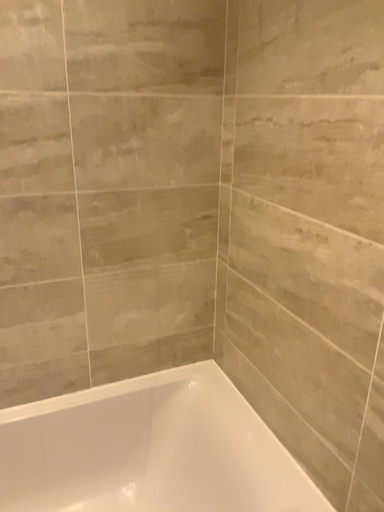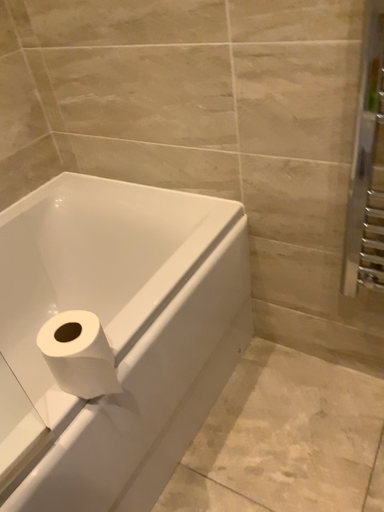
Question: Which way did the camera rotate in the video?

Choices:
 (A) rotated upward
 (B) rotated downward

Answer: (B)